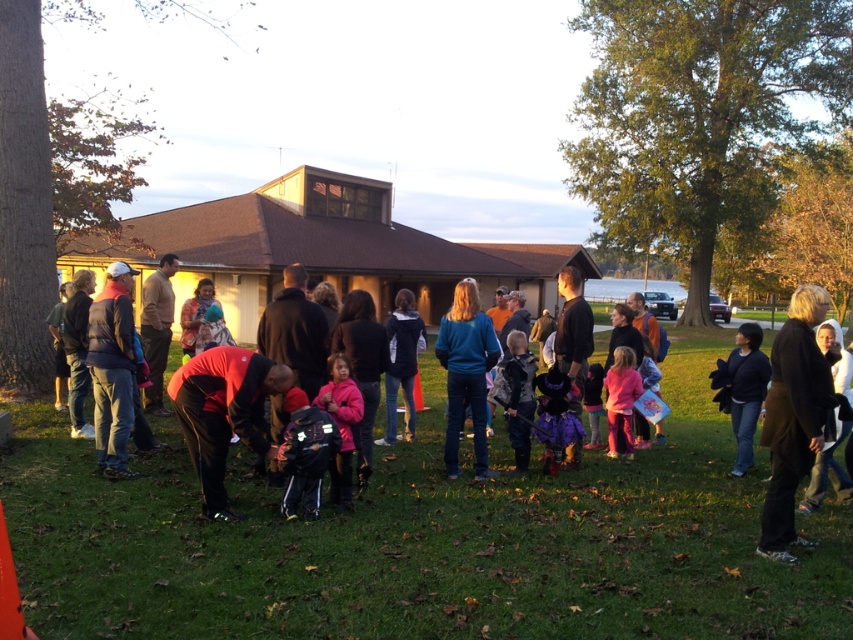
Between point (343, 460) and point (573, 417), which one is positioned behind?

Point (573, 417)

Who is taller, matte pink jacket at center or purple satin dress at center?

matte pink jacket at center is taller.

Between point (335, 476) and point (553, 388), which one is positioned behind?

The point (553, 388) is behind.

Where is `matte pink jacket at center`? matte pink jacket at center is located at coordinates pos(341,426).

Is matte black backpack at center taller than pink matte dress at lower right?

Yes, matte black backpack at center is taller than pink matte dress at lower right.

Is point (157, 468) closer to viewer compared to point (631, 403)?

Yes, it is in front of point (631, 403).

What do you see at coordinates (444, 524) in the screenshot? This screenshot has height=640, width=853. I see `matte black backpack at center` at bounding box center [444, 524].

At what (x,y) coordinates should I click in order to perform the action: click on matte black backpack at center. Please return your answer as a coordinate pair (x, y). This screenshot has width=853, height=640. Looking at the image, I should click on click(x=444, y=524).

Does purple satin dress at center have a smaller size compared to pink matte dress at lower right?

Incorrect, purple satin dress at center is not smaller in size than pink matte dress at lower right.

Between purple satin dress at center and pink matte dress at lower right, which one is positioned higher?

pink matte dress at lower right is above.

Locate an element on the screen. purple satin dress at center is located at coordinates (555, 417).

Identify the location of purple satin dress at center. (555, 417).